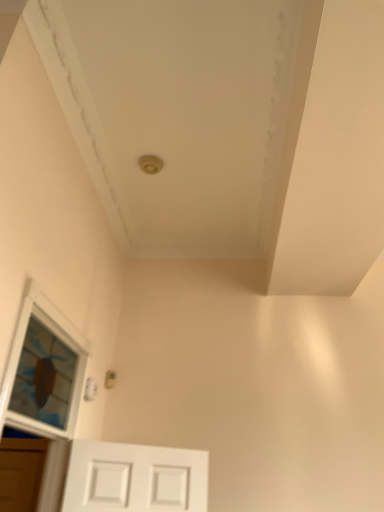
Describe the element at coordinates (43, 370) in the screenshot. This screenshot has height=512, width=384. I see `transparent glass window at lower left` at that location.

Find the location of a particular element. This screenshot has height=512, width=384. transparent glass window at lower left is located at coordinates (43, 370).

The image size is (384, 512). Identify the location of transparent glass window at lower left. (43, 370).